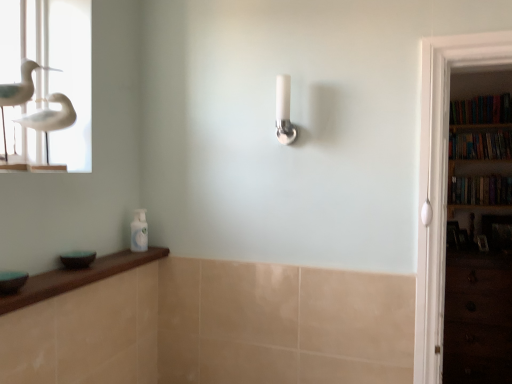
Measure the distance between point (504, 105) and camera.

The distance of point (504, 105) from camera is 3.09 meters.

Where is `white glossy shower head at center`? white glossy shower head at center is located at coordinates (284, 111).

You are a GUI agent. You are given a task and a screenshot of the screen. Output one action in this format:
    pyautogui.click(x=<x>, y=<y>)
    Task: Click on the dark wood drawer at lower right
    The width and height of the screenshot is (512, 384).
    Given the screenshot: What is the action you would take?
    pyautogui.click(x=478, y=318)

Locate an element on the screen. The height and width of the screenshot is (384, 512). wooden bookshelf at right, marked as the 1th book in a bottom-to-top arrangement is located at coordinates (480, 190).

What is the approximate width of wooden bookshelf at right, marked as the 1th book in a bottom-to-top arrangement?

6.67 inches.

Where is `hardcover books at right, the second book from the top`? Image resolution: width=512 pixels, height=384 pixels. hardcover books at right, the second book from the top is located at coordinates (481, 145).

Considering the relative positions of wooden bookshelf at right, marked as the 1th book in a bottom-to-top arrangement, and dark wood drawer at lower right in the image provided, is wooden bookshelf at right, marked as the 1th book in a bottom-to-top arrangement, to the left or to the right of dark wood drawer at lower right?

wooden bookshelf at right, marked as the 1th book in a bottom-to-top arrangement, is to the right of dark wood drawer at lower right.

Which point is more forward, (477, 201) or (498, 347)?

The point (498, 347) is closer to the camera.

How many degrees apart are the facing directions of wooden bookshelf at right, which is the 3th book from top to bottom, and dark wood drawer at lower right?

wooden bookshelf at right, which is the 3th book from top to bottom, and dark wood drawer at lower right are facing 0.000167 degrees away from each other.

Which object is closer to the camera taking this photo, wooden bookshelf at right, which is the 3th book from top to bottom, or dark wood drawer at lower right?

dark wood drawer at lower right.

Consider the image. Who is bigger, hardcover books at right, which appears as the second book when ordered from the bottom, or wooden bookshelf at right, marked as the 1th book in a bottom-to-top arrangement?

Bigger between the two is wooden bookshelf at right, marked as the 1th book in a bottom-to-top arrangement.

From the image's perspective, which one is positioned higher, hardcover books at right, the second book from the top, or wooden bookshelf at right, which is the 3th book from top to bottom?

From the image's view, hardcover books at right, the second book from the top, is above.

Does hardcover books at right, which appears as the second book when ordered from the bottom, turn towards wooden bookshelf at right, which is the 3th book from top to bottom?

No, hardcover books at right, which appears as the second book when ordered from the bottom, does not turn towards wooden bookshelf at right, which is the 3th book from top to bottom.

Which object is positioned more to the left, hardcover books at right, the second book from the top, or wooden bookshelf at right, which is the 3th book from top to bottom?

From the viewer's perspective, wooden bookshelf at right, which is the 3th book from top to bottom, appears more on the left side.

Who is shorter, dark wood drawer at lower right or hardcover books at right, the second book from the top?

Standing shorter between the two is hardcover books at right, the second book from the top.

Which object is thinner, dark wood drawer at lower right or hardcover books at right, which appears as the second book when ordered from the bottom?

hardcover books at right, which appears as the second book when ordered from the bottom, is thinner.

Based on their sizes in the image, would you say dark wood drawer at lower right is bigger or smaller than hardcover books at right, the second book from the top?

Considering their sizes, dark wood drawer at lower right takes up more space than hardcover books at right, the second book from the top.

Considering the positions of objects hardcover books at right, which appears as the second book when ordered from the bottom, and dark wood drawer at lower right in the image provided, who is more to the left, hardcover books at right, which appears as the second book when ordered from the bottom, or dark wood drawer at lower right?

dark wood drawer at lower right is more to the left.

Which point is more forward, (507, 132) or (475, 362)?

Positioned in front is point (475, 362).

Between hardcover books at right, the second book from the top, and dark wood drawer at lower right, which one is positioned behind?

hardcover books at right, the second book from the top, is further from the camera.

Is hardcover books at right, which appears as the second book when ordered from the bottom, facing towards dark wood drawer at lower right?

No, hardcover books at right, which appears as the second book when ordered from the bottom, is not turned towards dark wood drawer at lower right.

Relative to white glossy shower head at center, is hardcover books at right, the 3th book ordered from the bottom, in front or behind?

hardcover books at right, the 3th book ordered from the bottom, is positioned farther from the viewer than white glossy shower head at center.

Identify the location of book that is the 1st object to the right of the white glossy shower head at center, starting at the anchor. (482, 110).

How different are the orientations of hardcover books at right, marked as the 1th book in a top-to-bottom arrangement, and white glossy shower head at center in degrees?

The facing directions of hardcover books at right, marked as the 1th book in a top-to-bottom arrangement, and white glossy shower head at center are 0.318 degrees apart.

Could you tell me if hardcover books at right, the 3th book ordered from the bottom, is turned towards white glossy shower head at center?

Yes, hardcover books at right, the 3th book ordered from the bottom, faces towards white glossy shower head at center.

Is white glossy shower head at center next to dark wood drawer at lower right?

No, white glossy shower head at center is not beside dark wood drawer at lower right.

Is dark wood drawer at lower right at the back of white glossy shower head at center?

No.

Find the location of a particular element. drawer below the white glossy shower head at center (from the image's perspective) is located at coordinates (478, 318).

Looking at this image, does white glossy shower head at center have a lesser width compared to dark wood drawer at lower right?

Yes.

From the image's perspective, which is below, hardcover books at right, which appears as the second book when ordered from the bottom, or white glossy shower head at center?

white glossy shower head at center appears lower in the image.

Measure the distance between hardcover books at right, the second book from the top, and white glossy shower head at center.

7.14 feet.

Is hardcover books at right, which appears as the second book when ordered from the bottom, facing away from white glossy shower head at center?

That's not correct — hardcover books at right, which appears as the second book when ordered from the bottom, is not looking away from white glossy shower head at center.

From a real-world perspective, which object stands above the other?

white glossy shower head at center.

Where is `drawer that is in front of the wooden bookshelf at right, marked as the 1th book in a bottom-to-top arrangement`? This screenshot has width=512, height=384. drawer that is in front of the wooden bookshelf at right, marked as the 1th book in a bottom-to-top arrangement is located at coordinates click(478, 318).

The image size is (512, 384). In order to click on book below the hardcover books at right, which appears as the second book when ordered from the bottom (from a real-world perspective) in this screenshot , I will do `click(480, 190)`.

Based on their spatial positions, is white matte bird at upper left or dark wood drawer at lower right further from white glossy shower head at center?

dark wood drawer at lower right lies further to white glossy shower head at center than the other object.

Estimate the real-world distances between objects in this image. Which object is closer to hardcover books at right, the 3th book ordered from the bottom, dark wood drawer at lower right or hardcover books at right, the second book from the top?

Among the two, hardcover books at right, the second book from the top, is located nearer to hardcover books at right, the 3th book ordered from the bottom.

Based on their spatial positions, is white matte bird at upper left or wooden bookshelf at right, marked as the 1th book in a bottom-to-top arrangement, closer to hardcover books at right, marked as the 1th book in a top-to-bottom arrangement?

wooden bookshelf at right, marked as the 1th book in a bottom-to-top arrangement, is positioned closer to the anchor hardcover books at right, marked as the 1th book in a top-to-bottom arrangement.

Looking at the image, which one is located further to hardcover books at right, the second book from the top, white matte bird at upper left or wooden bookshelf at right, which is the 3th book from top to bottom?

white matte bird at upper left lies further to hardcover books at right, the second book from the top, than the other object.

Which object lies further to the anchor point hardcover books at right, the 3th book ordered from the bottom, dark wood drawer at lower right or white matte bird at upper left?

Based on the image, white matte bird at upper left appears to be further to hardcover books at right, the 3th book ordered from the bottom.

Considering their positions, is hardcover books at right, marked as the 1th book in a top-to-bottom arrangement, positioned closer to wooden bookshelf at right, marked as the 1th book in a bottom-to-top arrangement, than dark wood drawer at lower right?

hardcover books at right, marked as the 1th book in a top-to-bottom arrangement, lies closer to wooden bookshelf at right, marked as the 1th book in a bottom-to-top arrangement, than the other object.

Considering their positions, is white matte bird at upper left positioned closer to dark wood drawer at lower right than hardcover books at right, marked as the 1th book in a top-to-bottom arrangement?

hardcover books at right, marked as the 1th book in a top-to-bottom arrangement, is closer to dark wood drawer at lower right.

From the image, which object appears to be farther from wooden bookshelf at right, marked as the 1th book in a bottom-to-top arrangement, dark wood drawer at lower right or white glossy shower head at center?

white glossy shower head at center.

This screenshot has height=384, width=512. Find the location of `shower between white matte bird at upper left and wooden bookshelf at right, which is the 3th book from top to bottom`. shower between white matte bird at upper left and wooden bookshelf at right, which is the 3th book from top to bottom is located at coordinates (284, 111).

Where is `book between hardcover books at right, which appears as the second book when ordered from the bottom, and dark wood drawer at lower right from top to bottom`? Image resolution: width=512 pixels, height=384 pixels. book between hardcover books at right, which appears as the second book when ordered from the bottom, and dark wood drawer at lower right from top to bottom is located at coordinates (480, 190).

At what (x,y) coordinates should I click in order to perform the action: click on drawer between white matte bird at upper left and wooden bookshelf at right, which is the 3th book from top to bottom. Please return your answer as a coordinate pair (x, y). The image size is (512, 384). Looking at the image, I should click on (478, 318).

Where is `drawer between white matte bird at upper left and hardcover books at right, which appears as the second book when ordered from the bottom`? This screenshot has height=384, width=512. drawer between white matte bird at upper left and hardcover books at right, which appears as the second book when ordered from the bottom is located at coordinates (478, 318).